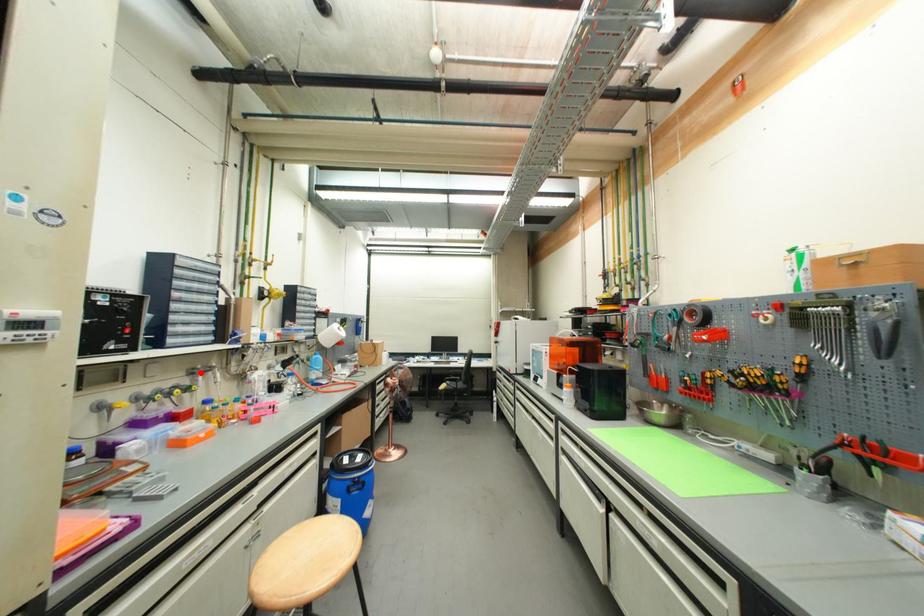
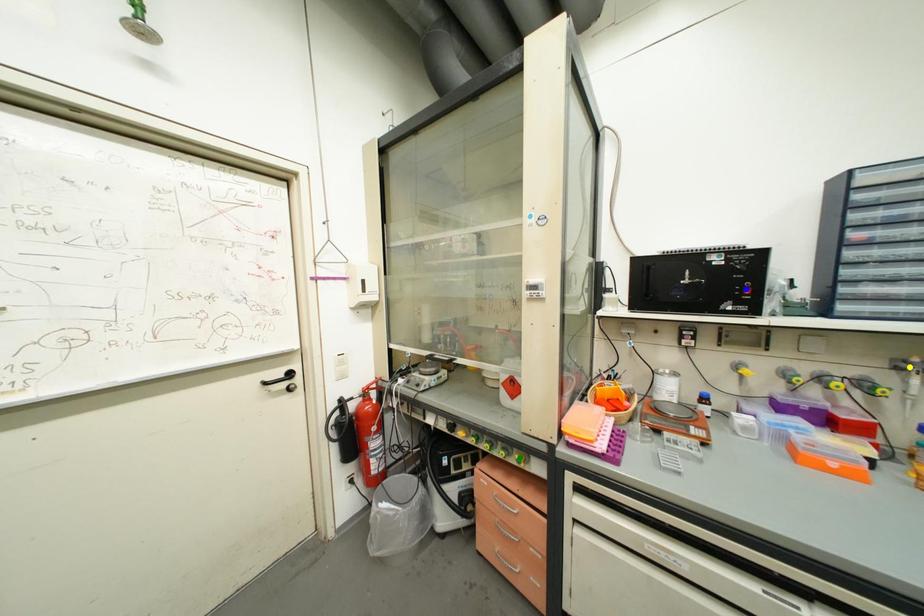
Question: I am providing you with two images of the same scene from different viewpoints. A red point is marked on the first image. You are given multiple points on the second image. In image 2, which mark is for the same physical point as the one in image 1?

Choices:
 (A) green point
 (B) blue point
 (C) yellow point

Answer: (C)